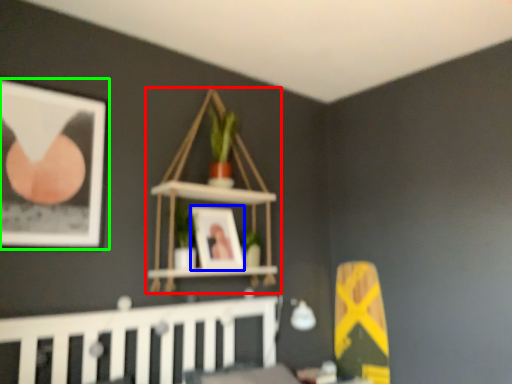
Question: Which object is the farthest from shelf (highlighted by a red box)? Choose among these: picture frame (highlighted by a blue box) or picture frame (highlighted by a green box).

Choices:
 (A) picture frame
 (B) picture frame

Answer: (B)